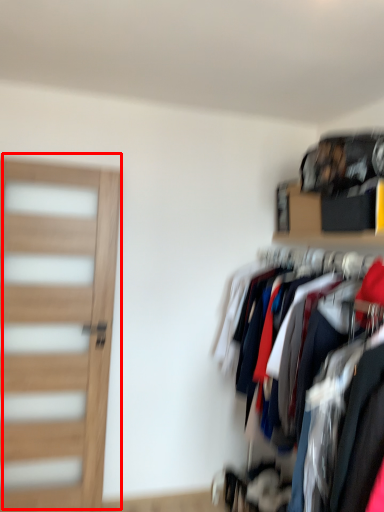
Question: In this image, where is door (annotated by the red box) located relative to shelf?

Choices:
 (A) left
 (B) right

Answer: (A)